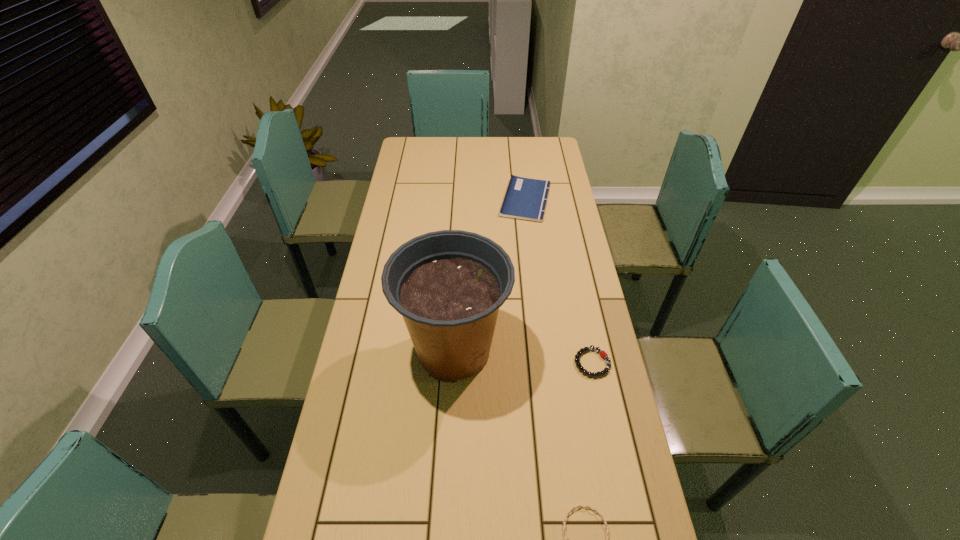
This screenshot has height=540, width=960. I want to click on the tallest object, so click(x=448, y=285).

Where is `the farthest object`? The width and height of the screenshot is (960, 540). the farthest object is located at coordinates (525, 198).

The image size is (960, 540). Identify the location of the second tallest object. (525, 198).

Find the location of `the taller bracelet`. the taller bracelet is located at coordinates [603, 354].

Find the location of a particular element. This screenshot has height=540, width=960. the third tallest object is located at coordinates (603, 354).

At what (x,y) coordinates should I click in order to perform the action: click on vacant space positioned on the front of the tallest object. Please return your answer as a coordinate pair (x, y). The image size is (960, 540). Looking at the image, I should click on (449, 444).

Find the location of a particular element. Image resolution: width=960 pixels, height=540 pixels. vacant area located 0.340m on the front of the third shortest object is located at coordinates (536, 285).

Locate an element on the screen. This screenshot has width=960, height=540. vacant space located on the back of the third tallest object is located at coordinates (575, 279).

Find the location of `object located in the left edge section of the desktop`. object located in the left edge section of the desktop is located at coordinates (448, 285).

Image resolution: width=960 pixels, height=540 pixels. What are the coordinates of `paperback book located in the right edge section of the desktop` in the screenshot? It's located at (525, 198).